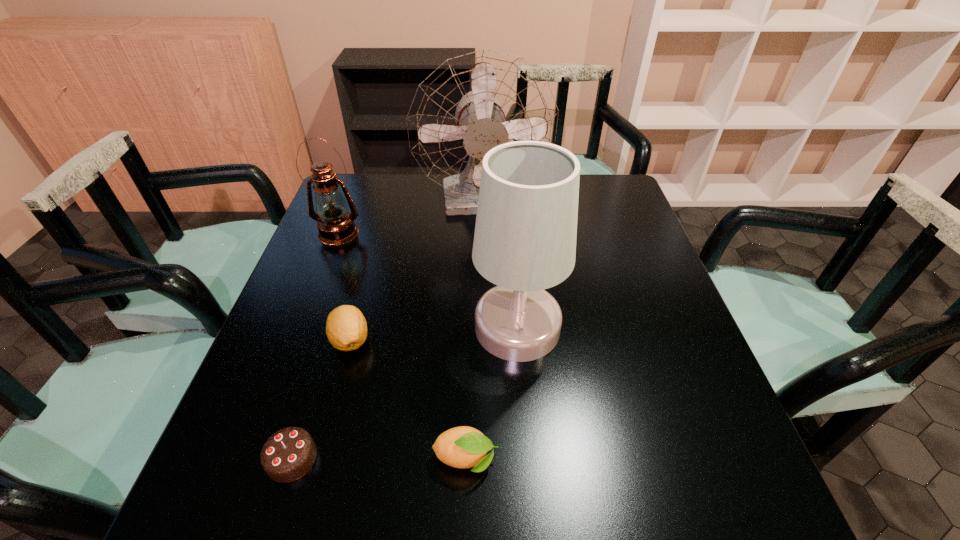
This screenshot has height=540, width=960. Find the location of `vacant space located on the right of the oil lamp`. vacant space located on the right of the oil lamp is located at coordinates (461, 233).

Locate an element on the screen. vacant space situated 0.060m at the stem end of the left lemon is located at coordinates (338, 386).

Where is `vacant space situated with leaves positioned above the right lemon`? vacant space situated with leaves positioned above the right lemon is located at coordinates (555, 460).

Locate an element on the screen. The height and width of the screenshot is (540, 960). free spot located on the right of the shortest object is located at coordinates (414, 458).

Locate an element on the screen. object located in the far edge section of the desktop is located at coordinates (470, 104).

Locate an element on the screen. This screenshot has height=540, width=960. lemon that is at the near edge is located at coordinates (463, 447).

At what (x,y) coordinates should I click in order to perform the action: click on chocolate cake positioned at the near edge. Please return your answer as a coordinate pair (x, y). This screenshot has width=960, height=540. Looking at the image, I should click on (289, 454).

Image resolution: width=960 pixels, height=540 pixels. In order to click on oil lamp that is at the left edge in this screenshot , I will do click(x=336, y=226).

Locate an element on the screen. The width and height of the screenshot is (960, 540). lemon situated at the left edge is located at coordinates (346, 328).

Locate an element on the screen. This screenshot has height=540, width=960. chocolate cake that is at the left edge is located at coordinates (289, 454).